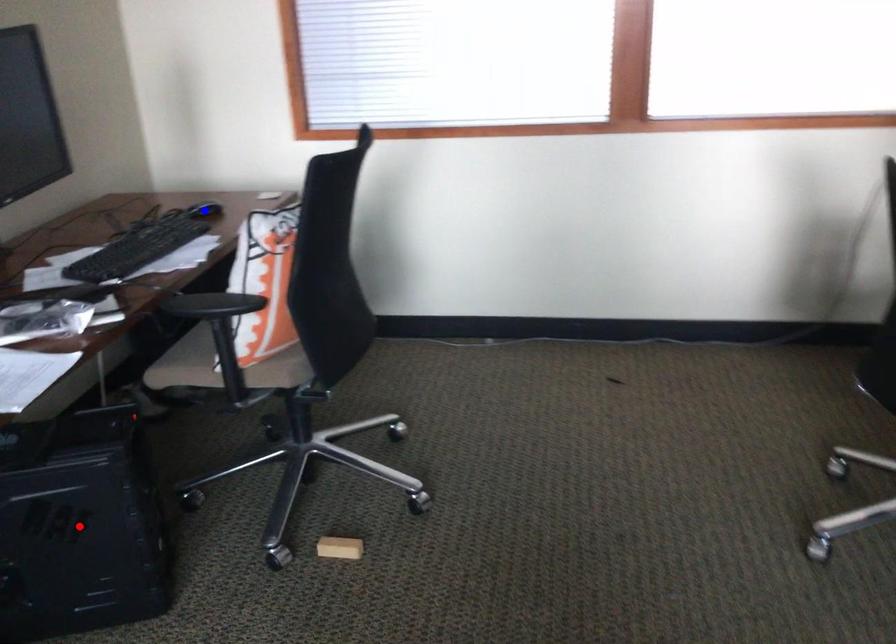
Question: In the image, two points are highlighted. Which point is nearer to the camera? Reply with the corresponding letter.

Choices:
 (A) blue point
 (B) red point

Answer: (B)